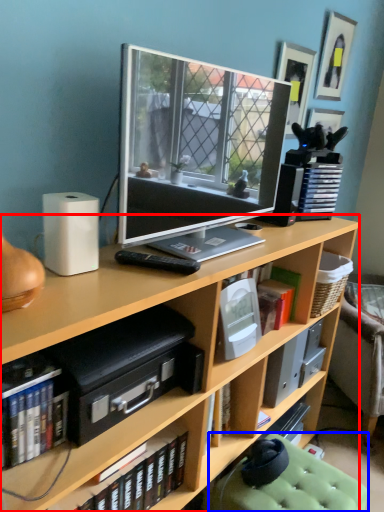
Question: Which of the following is the closest to the observer, bookcase (highlighted by a red box) or swivel chair (highlighted by a blue box)?

Choices:
 (A) bookcase
 (B) swivel chair

Answer: (A)